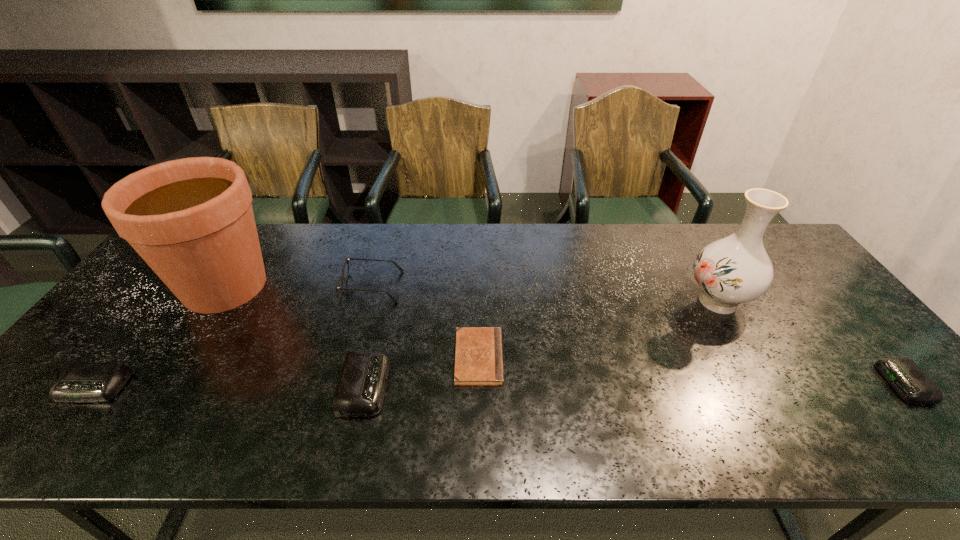
This screenshot has height=540, width=960. What are the coordinates of `the leftmost alarm clock` in the screenshot? It's located at (80, 382).

Find the location of `the second tallest alarm clock`. the second tallest alarm clock is located at coordinates (80, 382).

The width and height of the screenshot is (960, 540). In order to click on the second alarm clock from right to left in this screenshot , I will do `click(360, 390)`.

You are a GUI agent. You are given a task and a screenshot of the screen. Output one action in this format:
    pyautogui.click(x=<x>, y=<y>)
    Task: Click on the rightmost alarm clock
    This screenshot has width=960, height=540.
    Given the screenshot: What is the action you would take?
    pyautogui.click(x=903, y=374)

The width and height of the screenshot is (960, 540). Find the location of `the rightmost object`. the rightmost object is located at coordinates (903, 374).

The image size is (960, 540). I want to click on flowerpot, so tap(191, 220).

I want to click on the fifth shortest object, so click(x=341, y=276).

Image resolution: width=960 pixels, height=540 pixels. Identify the location of vase. coord(734,270).

At what (x,y) coordinates should I click in order to perform the action: click on diary. Please return your answer as a coordinate pair (x, y). Looking at the image, I should click on (478, 359).

At what (x,y) coordinates should I click in order to perform the action: click on the fifth object from left to right. Please return your answer as a coordinate pair (x, y). Looking at the image, I should click on (478, 359).